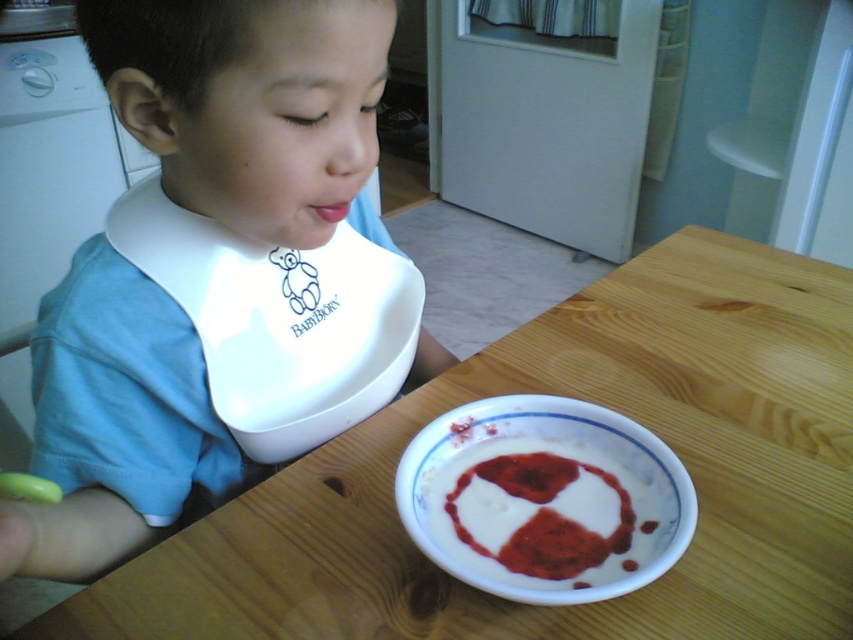
Is wooden table at center taller than white plastic bib at upper left?

Yes.

Who is taller, wooden table at center or white plastic bib at upper left?

Standing taller between the two is wooden table at center.

Between point (836, 280) and point (276, 456), which one is positioned behind?

The point (836, 280) is more distant.

Image resolution: width=853 pixels, height=640 pixels. In order to click on wooden table at center in this screenshot , I will do `click(576, 397)`.

Between blue fabric bib at upper left and pink matte lips at center, which one has more height?

blue fabric bib at upper left

Is blue fabric bib at upper left to the left of pink matte lips at center from the viewer's perspective?

Yes, blue fabric bib at upper left is to the left of pink matte lips at center.

Who is more distant from viewer, (171, 168) or (350, 200)?

The point (350, 200) is more distant.

Locate an element on the screen. Image resolution: width=853 pixels, height=640 pixels. blue fabric bib at upper left is located at coordinates (248, 100).

Can you confirm if white creamy food at lower center is thinner than pink matte lips at center?

Incorrect, white creamy food at lower center's width is not less than pink matte lips at center's.

Between white creamy food at lower center and pink matte lips at center, which one is positioned higher?

pink matte lips at center is above.

Is point (619, 544) behind point (345, 216)?

No, (619, 544) is in front of (345, 216).

At what (x,y) coordinates should I click in order to perform the action: click on white creamy food at lower center. Please return your answer as a coordinate pair (x, y). This screenshot has width=853, height=640. Looking at the image, I should click on (541, 513).